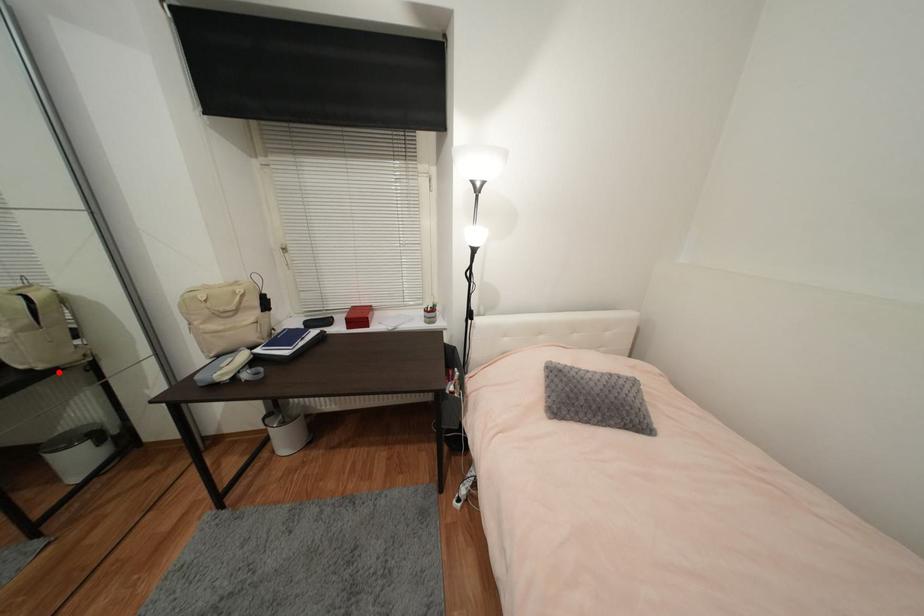
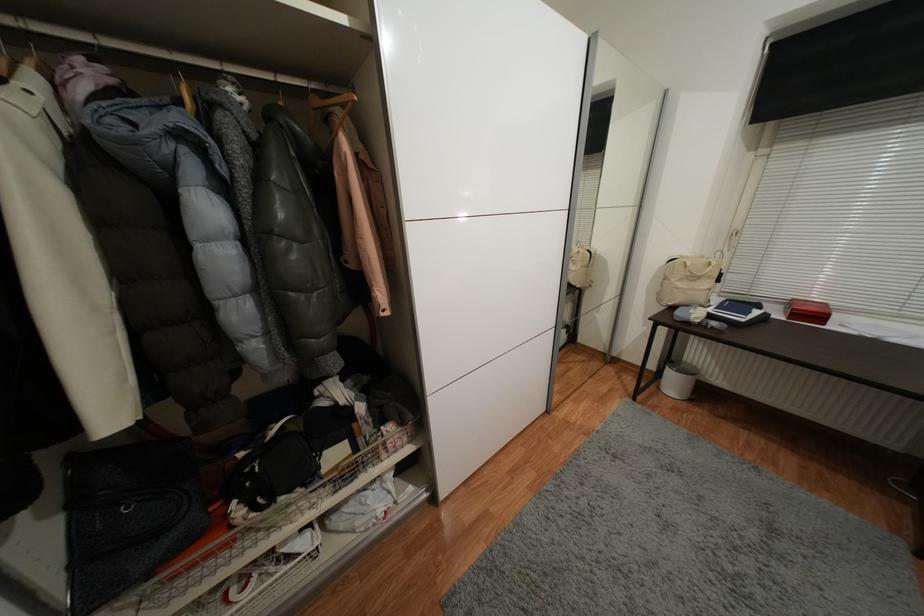
In the second image, find the point that corresponds to the highlighted location in the first image.

(582, 291)